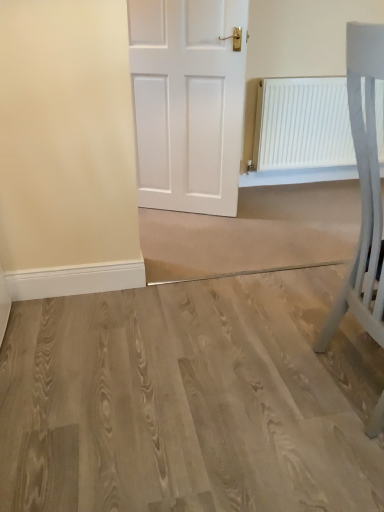
You are a GUI agent. You are given a task and a screenshot of the screen. Output one action in this format:
    pyautogui.click(x=<x>, y=<y>)
    Task: Click on the free space behind white matte chair at right
    
    Given the screenshot: What is the action you would take?
    (294, 310)